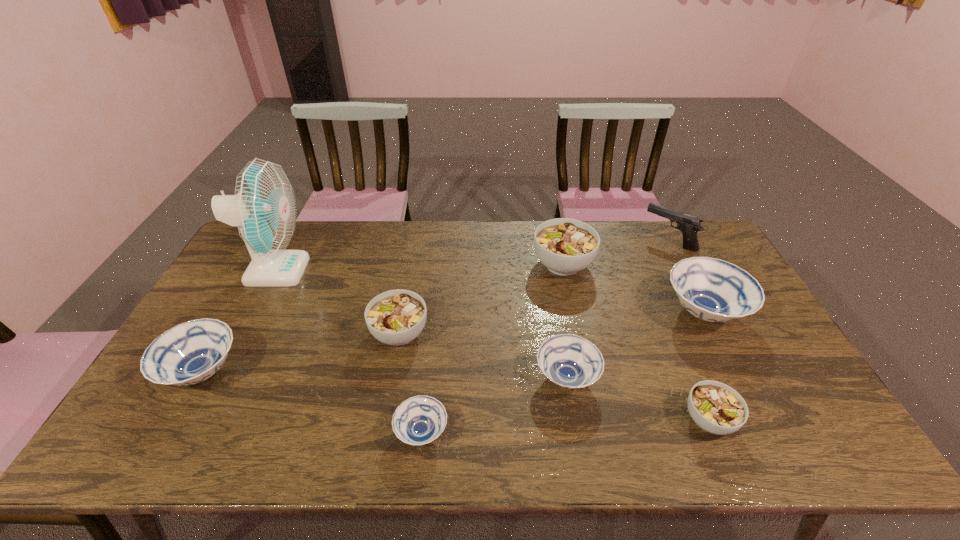
This screenshot has height=540, width=960. What are the coordinates of `soup bowl that is at the left edge` in the screenshot? It's located at (191, 352).

What are the coordinates of `gun present at the right edge` in the screenshot? It's located at (689, 225).

Where is `soup bowl at the right edge`? The image size is (960, 540). soup bowl at the right edge is located at coordinates (713, 290).

You are a GUI agent. You are given a task and a screenshot of the screen. Output one action in this format:
    pyautogui.click(x=<x>, y=<y>)
    Task: Click on the object positioned at the far left corner
    The image size is (960, 540).
    Given the screenshot: What is the action you would take?
    pyautogui.click(x=264, y=208)

Locate an element on the screen. The image size is (960, 540). object that is at the far right corner is located at coordinates (689, 225).

At what (x,y) coordinates should I click in order to perform the action: click on vacant region at the far edge of the desktop. Please return your answer as a coordinate pair (x, y). Looking at the image, I should click on (521, 228).

Where is `free space at the near edge`? Image resolution: width=960 pixels, height=540 pixels. free space at the near edge is located at coordinates (363, 438).

Locate an element on the screen. empty space that is in between the black gun and the second biggest blue soup bowl is located at coordinates (436, 307).

Find the location of a particular element. The image size is (960, 540). vacant area that lies between the biggest white soup bowl and the leftmost white soup bowl is located at coordinates (481, 299).

Find the location of a particular element. vacant area that lies between the biggest white soup bowl and the nearest blue soup bowl is located at coordinates (492, 348).